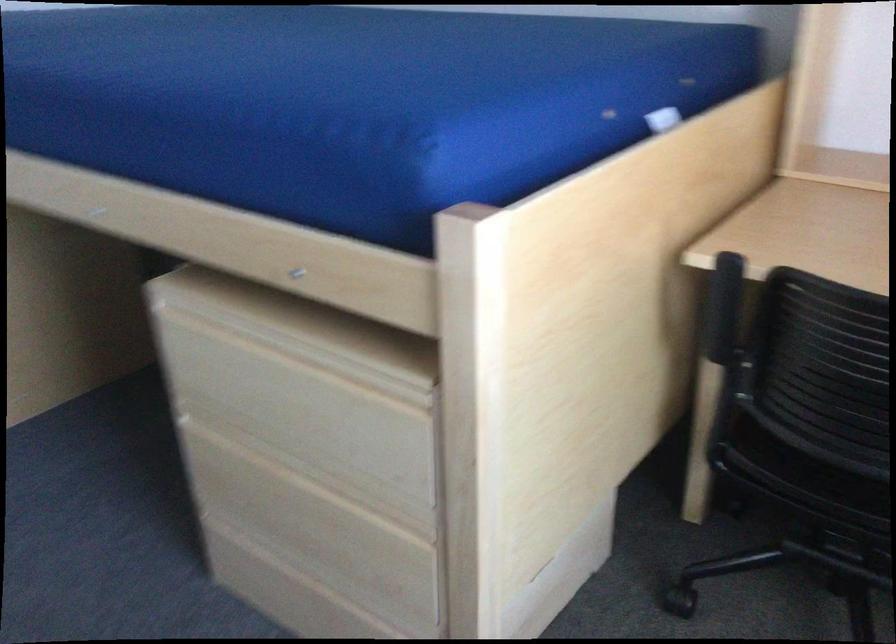
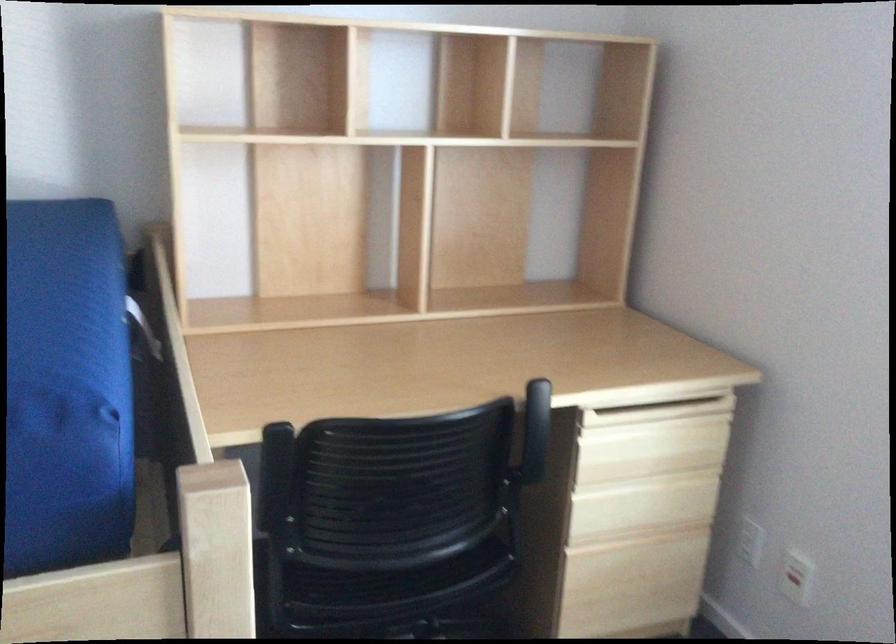
Locate, in the second image, the point that corresponds to [426,122] in the first image.

(66, 388)